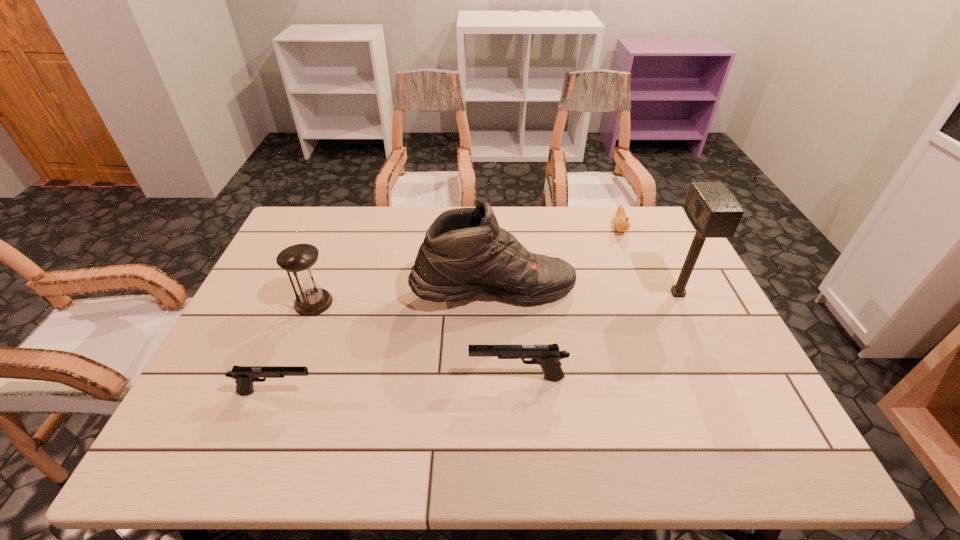
You are a GUI agent. You are given a task and a screenshot of the screen. Output one action in this format:
    pyautogui.click(x=<x>, y=<y>)
    Task: Click on the nearer gun
    This screenshot has width=960, height=540.
    Given the screenshot: What is the action you would take?
    pyautogui.click(x=244, y=376)

The image size is (960, 540). In order to click on the nearest object in this screenshot , I will do `click(244, 376)`.

Find the location of a particular element. the taller gun is located at coordinates (547, 356).

The image size is (960, 540). What are the coordinates of `the right gun` in the screenshot? It's located at (547, 356).

Where is `the farthest object`? the farthest object is located at coordinates (621, 220).

Where is `the second object from right to left`? The width and height of the screenshot is (960, 540). the second object from right to left is located at coordinates (621, 220).

Locate an element on the screen. This screenshot has height=540, width=960. ski boot is located at coordinates (464, 253).

You are a GUI agent. You are given a task and a screenshot of the screen. Output one action in this format:
    pyautogui.click(x=<x>, y=<y>)
    Task: Click on the hourglass
    Image resolution: width=960 pixels, height=540 pixels.
    Given the screenshot: What is the action you would take?
    pyautogui.click(x=311, y=300)

Image resolution: width=960 pixels, height=540 pixels. Identify the location of mallet. (713, 211).

Find the location of a particular element. This screenshot has width=960, height=540. vacant space situated at the aiming end of the left gun is located at coordinates (395, 392).